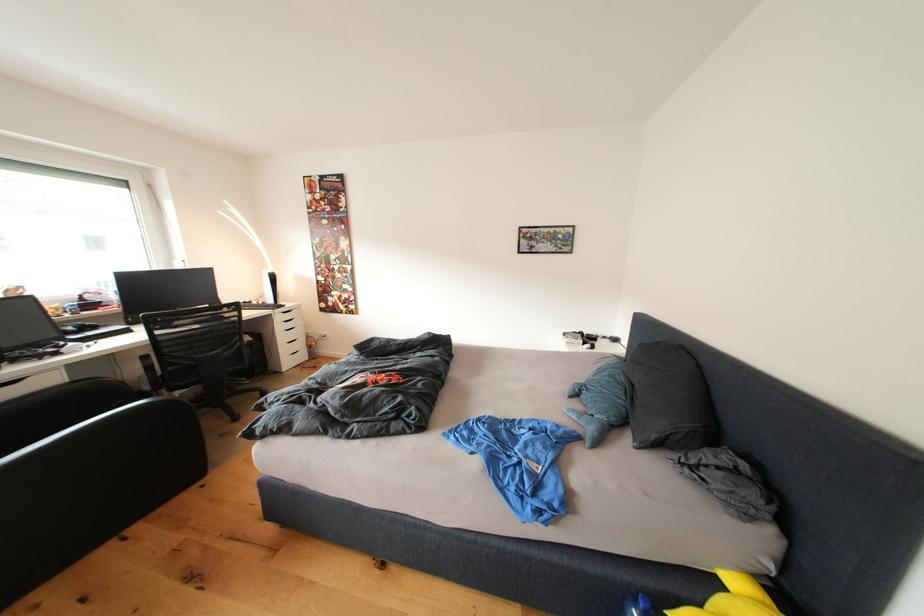
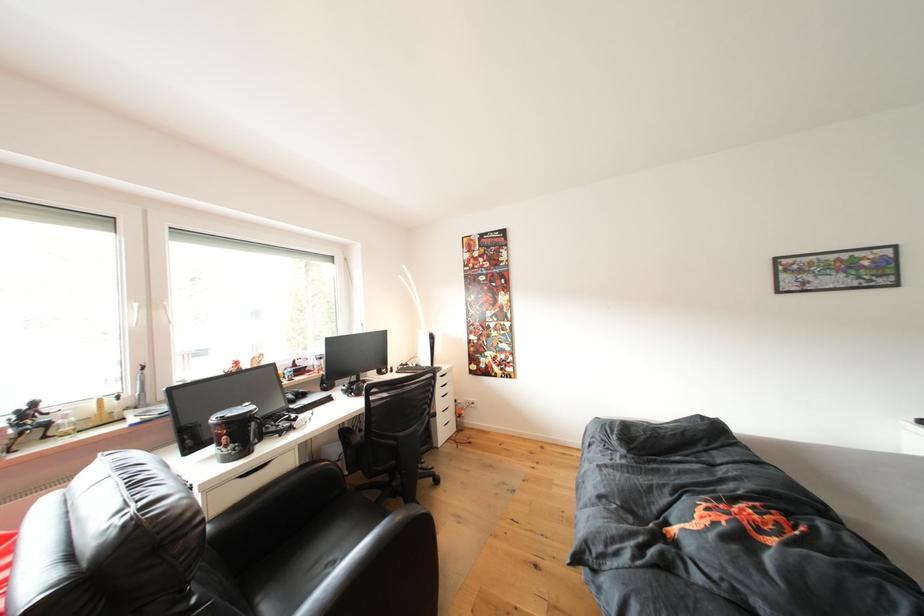
Question: I am providing you with two images of the same scene from different viewpoints. After the viewpoint changes to image2, which objects are now occluded?

Choices:
 (A) small action figure
 (B) dark grey pillow
 (C) white drawer handle
 (D) none of these

Answer: (D)